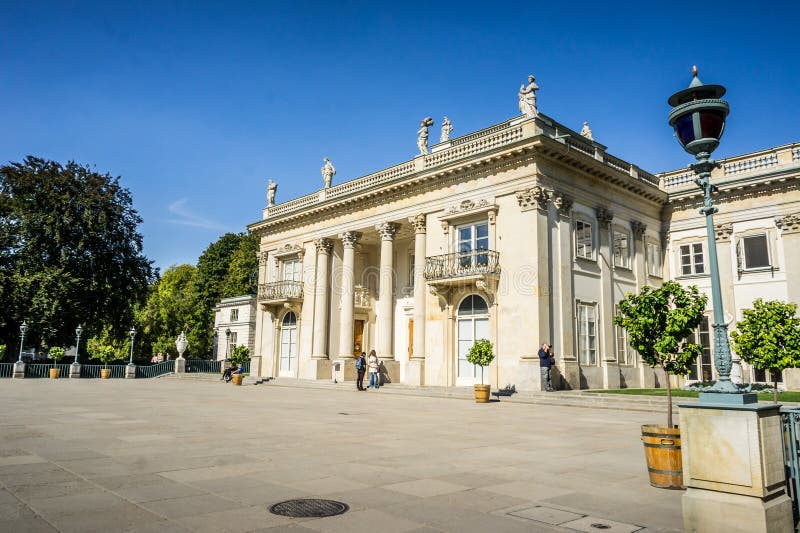
The width and height of the screenshot is (800, 533). I want to click on door, so click(x=357, y=344).